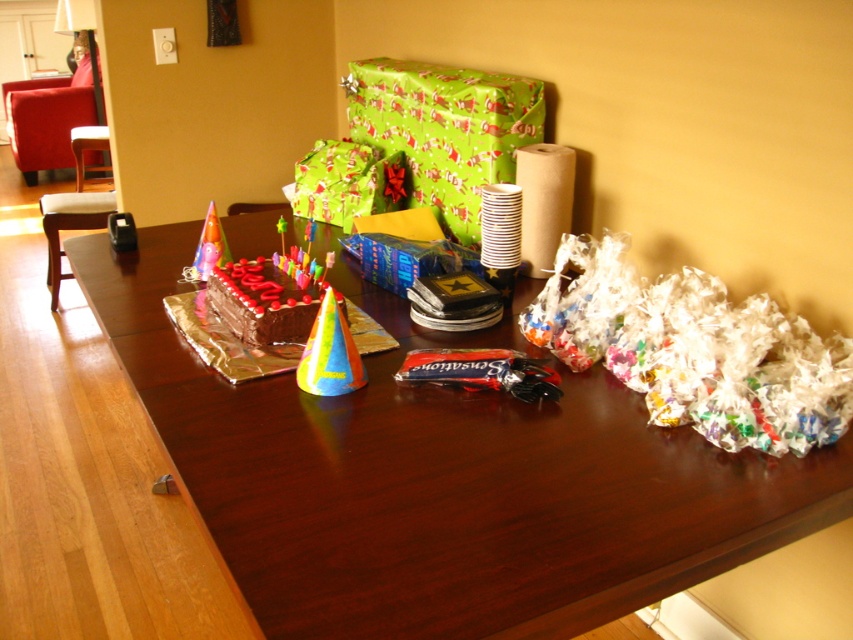
Question: Which of the following is the closest to the observer?

Choices:
 (A) brown cardboard roll at upper right
 (B) dark wood table at center
 (C) green shiny wrapping paper at upper center

Answer: (B)

Question: Which of these objects is positioned closest to the white crinkled paper at right?

Choices:
 (A) multicolored paper party hat at center
 (B) dark wood table at center
 (C) brown cardboard roll at upper right

Answer: (B)

Question: Does dark wood table at center lie behind multicolored paper party hat at center?

Choices:
 (A) yes
 (B) no

Answer: (B)

Question: Is white crinkled paper at right below brown cardboard roll at upper right?

Choices:
 (A) no
 (B) yes

Answer: (B)

Question: Does white crinkled paper at right have a lesser width compared to brown cardboard roll at upper right?

Choices:
 (A) no
 (B) yes

Answer: (A)

Question: Which object appears closest to the camera in this image?

Choices:
 (A) brown cardboard roll at upper right
 (B) matte paper party hat at center
 (C) green shiny wrapping paper at upper center

Answer: (A)